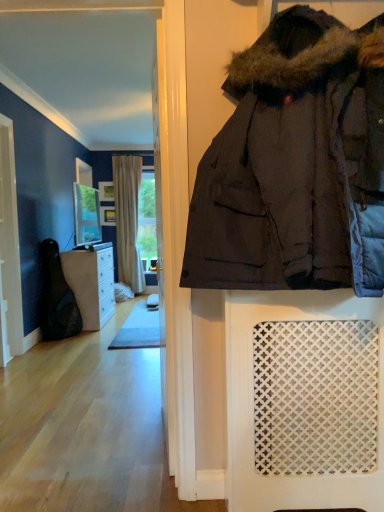
Question: Considering the relative sizes of matte glass mirror at upper center and dark brown puffy jacket at center in the image provided, is matte glass mirror at upper center shorter than dark brown puffy jacket at center?

Choices:
 (A) no
 (B) yes

Answer: (B)

Question: Does matte glass mirror at upper center have a smaller size compared to dark brown puffy jacket at center?

Choices:
 (A) yes
 (B) no

Answer: (A)

Question: Can you confirm if matte glass mirror at upper center is taller than dark brown puffy jacket at center?

Choices:
 (A) yes
 (B) no

Answer: (B)

Question: Is matte glass mirror at upper center aimed at dark brown puffy jacket at center?

Choices:
 (A) no
 (B) yes

Answer: (A)

Question: Is matte glass mirror at upper center outside dark brown puffy jacket at center?

Choices:
 (A) no
 (B) yes

Answer: (B)

Question: Is matte glass mirror at upper center oriented away from dark brown puffy jacket at center?

Choices:
 (A) no
 (B) yes

Answer: (A)

Question: Would you say wooden frame at center, which appears as the second picture frame when viewed from the top, is outside beige textured curtain at center?

Choices:
 (A) no
 (B) yes

Answer: (B)

Question: Considering the relative sizes of wooden frame at center, arranged as the 1th picture frame when ordered from the bottom, and beige textured curtain at center in the image provided, is wooden frame at center, arranged as the 1th picture frame when ordered from the bottom, taller than beige textured curtain at center?

Choices:
 (A) no
 (B) yes

Answer: (A)

Question: Is wooden frame at center, arranged as the 1th picture frame when ordered from the bottom, not near beige textured curtain at center?

Choices:
 (A) yes
 (B) no

Answer: (B)

Question: From the image's perspective, is wooden frame at center, which appears as the second picture frame when viewed from the top, located above beige textured curtain at center?

Choices:
 (A) yes
 (B) no

Answer: (A)

Question: Is the surface of wooden frame at center, which appears as the second picture frame when viewed from the top, in direct contact with beige textured curtain at center?

Choices:
 (A) no
 (B) yes

Answer: (A)

Question: Can you confirm if wooden frame at center, arranged as the 1th picture frame when ordered from the bottom, is wider than beige textured curtain at center?

Choices:
 (A) no
 (B) yes

Answer: (A)

Question: From the image's perspective, is white wood screen door at left under wooden frame at center, which appears as the second picture frame when viewed from the top?

Choices:
 (A) yes
 (B) no

Answer: (A)